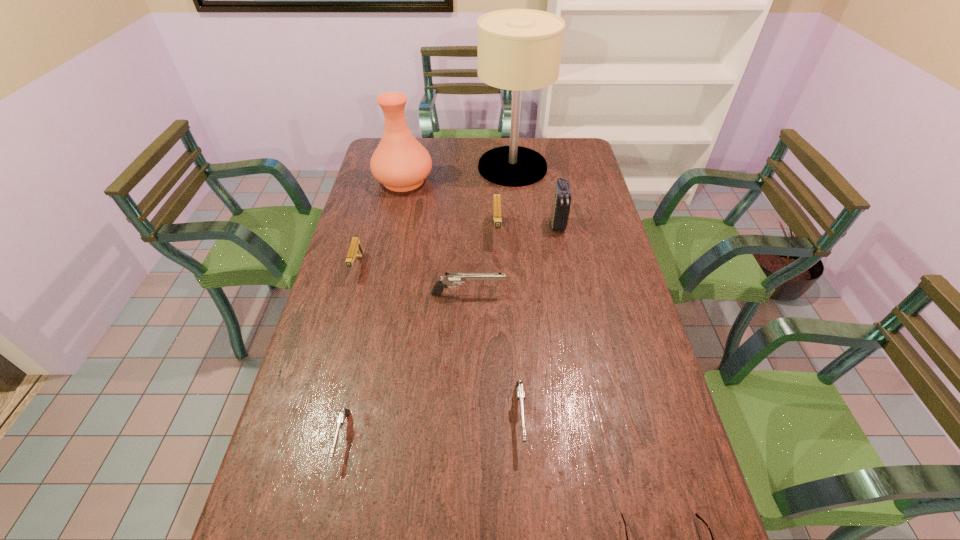
This screenshot has width=960, height=540. I want to click on the third shortest object, so click(x=520, y=390).

This screenshot has width=960, height=540. I want to click on the rightmost silver pistol, so click(x=520, y=390).

The width and height of the screenshot is (960, 540). I want to click on the fourth pistol from right to left, so click(344, 413).

This screenshot has width=960, height=540. I want to click on the smallest silver pistol, so click(344, 413).

Where is `vacant region located on the left of the tallest object`? The height and width of the screenshot is (540, 960). vacant region located on the left of the tallest object is located at coordinates (401, 167).

Where is `vacant space positioned on the front of the vase`? Image resolution: width=960 pixels, height=540 pixels. vacant space positioned on the front of the vase is located at coordinates (396, 215).

Where is `blank space located with the zip open on the third tallest object`? blank space located with the zip open on the third tallest object is located at coordinates (569, 287).

I want to click on vacant space located 0.340m at the barrel of the right tan pistol, so click(500, 328).

This screenshot has height=540, width=960. In order to click on vacant space located on the front-facing side of the biggest silver pistol in this screenshot , I will do `click(531, 294)`.

The width and height of the screenshot is (960, 540). I want to click on free space located at the barrel of the fifth farthest object, so click(333, 353).